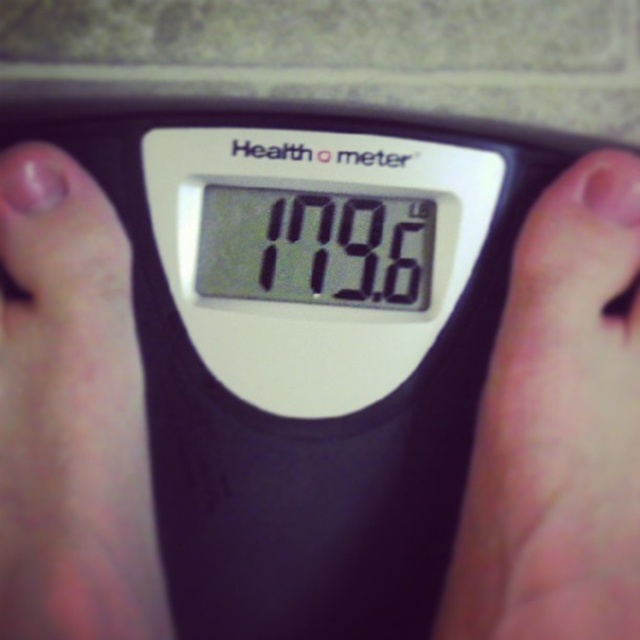
Question: Can you confirm if pale skin at center is positioned to the left of black digital display at center?

Choices:
 (A) no
 (B) yes

Answer: (A)

Question: Is pale skin at center smaller than black digital display at center?

Choices:
 (A) no
 (B) yes

Answer: (A)

Question: Can you confirm if pale skin at center is positioned below pink skin at left?

Choices:
 (A) yes
 (B) no

Answer: (A)

Question: Which object is positioned farthest from the black digital display at center?

Choices:
 (A) pale skin at center
 (B) pink skin at left

Answer: (A)

Question: Estimate the real-world distances between objects in this image. Which object is farther from the pink skin at left?

Choices:
 (A) pale skin at center
 (B) black digital display at center

Answer: (A)

Question: Which of the following is the closest to the observer?

Choices:
 (A) (228, 237)
 (B) (122, 266)

Answer: (B)